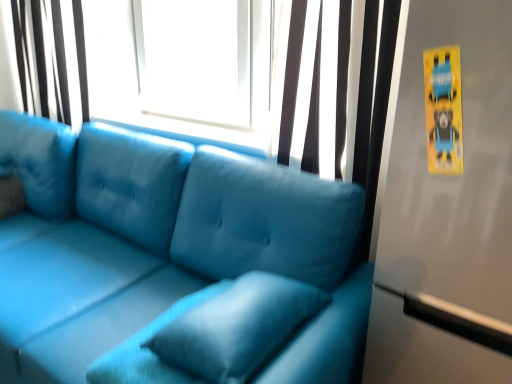
The image size is (512, 384). I want to click on transparent glass window at upper center, so click(182, 66).

You are a GUI agent. You are given a task and a screenshot of the screen. Output one action in this format:
    pyautogui.click(x=<x>, y=<y>)
    Task: Click on the matte white curtain at upper left, which appears as the second curtain when viewed from the front
    Image resolution: width=512 pixels, height=384 pixels.
    Given the screenshot: What is the action you would take?
    pyautogui.click(x=51, y=59)

Measure the distance between matte white curtain at upper left, which is counted as the first curtain, starting from the left, and camera.

matte white curtain at upper left, which is counted as the first curtain, starting from the left, and camera are 7.46 feet apart from each other.

Identify the location of matte blue couch at center. Image resolution: width=512 pixels, height=384 pixels. (162, 246).

The height and width of the screenshot is (384, 512). What do you see at coordinates (237, 327) in the screenshot? I see `velvet blue pillow at center` at bounding box center [237, 327].

Describe the element at coordinates (372, 102) in the screenshot. I see `matte black curtain at upper center, the second curtain viewed from the back` at that location.

The image size is (512, 384). I want to click on transparent glass window at upper center, so click(x=182, y=66).

Considering the points (34, 113) and (105, 175), which point is in front, point (34, 113) or point (105, 175)?

The point (105, 175) is in front.

In the image, is matte white curtain at upper left, which is counted as the first curtain, starting from the left, positioned in front of or behind matte blue couch at center?

Visually, matte white curtain at upper left, which is counted as the first curtain, starting from the left, is located behind matte blue couch at center.

From a real-world perspective, does matte white curtain at upper left, which is counted as the first curtain, starting from the left, stand above matte blue couch at center?

Indeed, from a real-world perspective, matte white curtain at upper left, which is counted as the first curtain, starting from the left, stands above matte blue couch at center.

This screenshot has height=384, width=512. In order to click on the 2nd curtain above the matte blue couch at center (from the image's perspective) in this screenshot , I will do `click(51, 59)`.

Can you tell me how much matte black curtain at upper center, acting as the 2th curtain starting from the left, and matte white curtain at upper left, marked as the 1th curtain in a back-to-front arrangement, differ in facing direction?

There is a 0.00026-degree angle between the facing directions of matte black curtain at upper center, acting as the 2th curtain starting from the left, and matte white curtain at upper left, marked as the 1th curtain in a back-to-front arrangement.

Which is nearer, (x=340, y=1) or (x=27, y=39)?

Point (x=340, y=1) is positioned closer to the camera compared to point (x=27, y=39).

In the scene shown: Is matte black curtain at upper center, which is counted as the 1th curtain, starting from the front, closer to camera compared to matte white curtain at upper left, which is counted as the first curtain, starting from the left?

Yes, it is in front of matte white curtain at upper left, which is counted as the first curtain, starting from the left.

Is matte black curtain at upper center, acting as the 2th curtain starting from the left, oriented towards matte white curtain at upper left, which is counted as the first curtain, starting from the left?

No, matte black curtain at upper center, acting as the 2th curtain starting from the left, is not facing towards matte white curtain at upper left, which is counted as the first curtain, starting from the left.

From the image's perspective, is velvet blue pillow at center positioned above or below matte blue couch at center?

Based on their image positions, velvet blue pillow at center is located above matte blue couch at center.

Is velvet blue pillow at center bigger or smaller than matte blue couch at center?

Clearly, velvet blue pillow at center is smaller in size than matte blue couch at center.

Based on the photo, between velvet blue pillow at center and matte blue couch at center, which one is positioned behind?

velvet blue pillow at center.

Does velvet blue pillow at center appear on the right side of matte blue couch at center?

Yes.

Is matte white curtain at upper left, which appears as the second curtain when viewed from the front, looking in the opposite direction of velvet blue pillow at center?

That's not correct — matte white curtain at upper left, which appears as the second curtain when viewed from the front, is not looking away from velvet blue pillow at center.

From a real-world perspective, which is physically below, matte white curtain at upper left, which appears as the second curtain when viewed from the front, or velvet blue pillow at center?

In real-world perspective, velvet blue pillow at center is lower.

Looking at their sizes, would you say matte white curtain at upper left, marked as the 1th curtain in a back-to-front arrangement, is wider or thinner than velvet blue pillow at center?

Clearly, matte white curtain at upper left, marked as the 1th curtain in a back-to-front arrangement, has less width compared to velvet blue pillow at center.

Is matte black curtain at upper center, positioned as the 1th curtain in right-to-left order, directly adjacent to velvet blue pillow at center?

No, matte black curtain at upper center, positioned as the 1th curtain in right-to-left order, is not making contact with velvet blue pillow at center.

Which of these two, matte black curtain at upper center, which is counted as the 1th curtain, starting from the front, or velvet blue pillow at center, is smaller?

velvet blue pillow at center is smaller.

Considering the positions of objects matte black curtain at upper center, the second curtain viewed from the back, and velvet blue pillow at center in the image provided, who is more to the left, matte black curtain at upper center, the second curtain viewed from the back, or velvet blue pillow at center?

velvet blue pillow at center.

From a real-world perspective, which curtain is the 1st one underneath the transparent glass window at upper center? Please provide its 2D coordinates.

[(51, 59)]

Is transparent glass window at upper center to the left of matte white curtain at upper left, which is counted as the first curtain, starting from the left, from the viewer's perspective?

No, transparent glass window at upper center is not to the left of matte white curtain at upper left, which is counted as the first curtain, starting from the left.

Can you see transparent glass window at upper center touching matte white curtain at upper left, which is counted as the first curtain, starting from the left?

No, transparent glass window at upper center is not beside matte white curtain at upper left, which is counted as the first curtain, starting from the left.

Is transparent glass window at upper center behind matte white curtain at upper left, the 2th curtain in the right-to-left sequence?

No, the depth of transparent glass window at upper center is less than that of matte white curtain at upper left, the 2th curtain in the right-to-left sequence.

How far apart are transparent glass window at upper center and velvet blue pillow at center?

They are 1.22 meters apart.

Image resolution: width=512 pixels, height=384 pixels. I want to click on pillow on the right of transparent glass window at upper center, so click(237, 327).

Is transparent glass window at upper center closer to camera compared to velvet blue pillow at center?

No, the depth of transparent glass window at upper center is greater than that of velvet blue pillow at center.

Based on their positions, is transparent glass window at upper center located to the left or right of velvet blue pillow at center?

From the image, it's evident that transparent glass window at upper center is to the left of velvet blue pillow at center.

At what (x,y) coordinates should I click in order to perform the action: click on curtain that is on the left side of matte blue couch at center. Please return your answer as a coordinate pair (x, y). This screenshot has height=384, width=512. Looking at the image, I should click on (51, 59).

At what (x,y) coordinates should I click in order to perform the action: click on curtain below the matte white curtain at upper left, which is counted as the first curtain, starting from the left (from the image's perspective). Please return your answer as a coordinate pair (x, y). Image resolution: width=512 pixels, height=384 pixels. Looking at the image, I should click on (372, 102).

When comparing their distances from matte blue couch at center, does matte white curtain at upper left, which is counted as the first curtain, starting from the left, or transparent glass window at upper center seem closer?

Based on the image, transparent glass window at upper center appears to be nearer to matte blue couch at center.

Which object lies nearer to the anchor point matte white curtain at upper left, marked as the 1th curtain in a back-to-front arrangement, velvet blue pillow at center or matte blue couch at center?

Based on the image, matte blue couch at center appears to be nearer to matte white curtain at upper left, marked as the 1th curtain in a back-to-front arrangement.

Looking at the image, which one is located closer to matte black curtain at upper center, positioned as the 1th curtain in right-to-left order, velvet blue pillow at center or transparent glass window at upper center?

transparent glass window at upper center lies closer to matte black curtain at upper center, positioned as the 1th curtain in right-to-left order, than the other object.

From the picture: Estimate the real-world distances between objects in this image. Which object is closer to matte blue couch at center, transparent glass window at upper center or velvet blue pillow at center?

The object closer to matte blue couch at center is velvet blue pillow at center.

Which object lies further to the anchor point velvet blue pillow at center, matte blue couch at center or transparent glass window at upper center?

The object further to velvet blue pillow at center is transparent glass window at upper center.

When comparing their distances from matte white curtain at upper left, marked as the 1th curtain in a back-to-front arrangement, does matte black curtain at upper center, positioned as the 1th curtain in right-to-left order, or transparent glass window at upper center seem closer?

transparent glass window at upper center is closer to matte white curtain at upper left, marked as the 1th curtain in a back-to-front arrangement.

Which object lies nearer to the anchor point matte white curtain at upper left, which is counted as the first curtain, starting from the left, velvet blue pillow at center or matte black curtain at upper center, acting as the 2th curtain starting from the left?

matte black curtain at upper center, acting as the 2th curtain starting from the left, lies closer to matte white curtain at upper left, which is counted as the first curtain, starting from the left, than the other object.

Considering their positions, is velvet blue pillow at center positioned closer to transparent glass window at upper center than matte white curtain at upper left, which appears as the second curtain when viewed from the front?

The object closer to transparent glass window at upper center is matte white curtain at upper left, which appears as the second curtain when viewed from the front.

This screenshot has height=384, width=512. What are the coordinates of `pillow located between matte blue couch at center and matte white curtain at upper left, marked as the 1th curtain in a back-to-front arrangement, in the depth direction` in the screenshot? It's located at coord(237,327).

The height and width of the screenshot is (384, 512). Find the location of `curtain between transparent glass window at upper center and velvet blue pillow at center vertically`. curtain between transparent glass window at upper center and velvet blue pillow at center vertically is located at coordinates (372, 102).

Locate an element on the screen. window screen located between matte white curtain at upper left, marked as the 1th curtain in a back-to-front arrangement, and matte black curtain at upper center, positioned as the 1th curtain in right-to-left order, in the left-right direction is located at coordinates (182, 66).

Where is `window screen positioned between velvet blue pillow at center and matte white curtain at upper left, which appears as the second curtain when viewed from the front, from near to far`? window screen positioned between velvet blue pillow at center and matte white curtain at upper left, which appears as the second curtain when viewed from the front, from near to far is located at coordinates (182, 66).